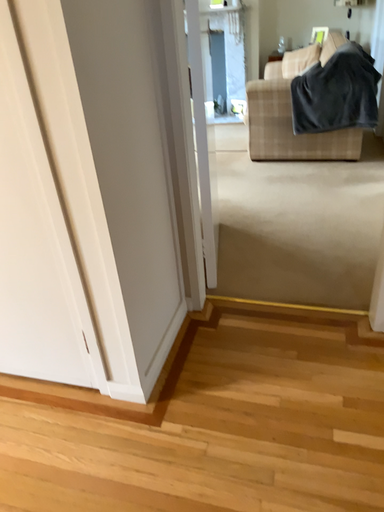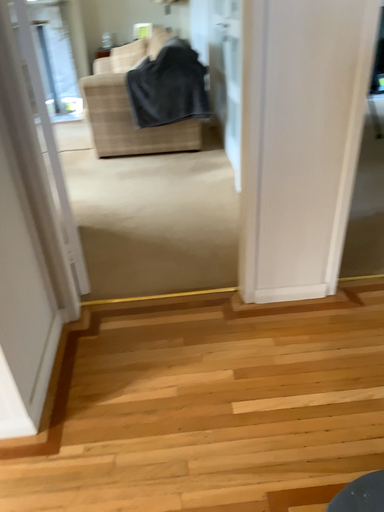
Question: How did the camera likely rotate when shooting the video?

Choices:
 (A) rotated right
 (B) rotated left

Answer: (A)